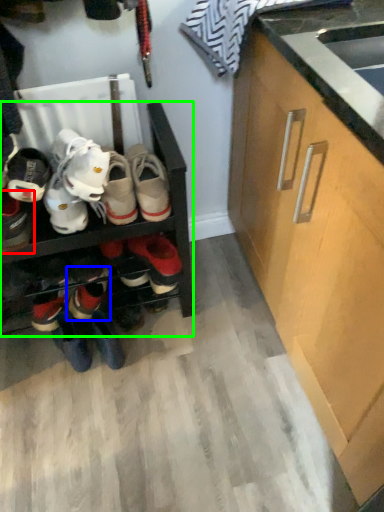
Question: Based on their relative distances, which object is farther from footwear (highlighted by a red box)? Choose from footwear (highlighted by a blue box) and shelf (highlighted by a green box).

Choices:
 (A) footwear
 (B) shelf

Answer: (A)